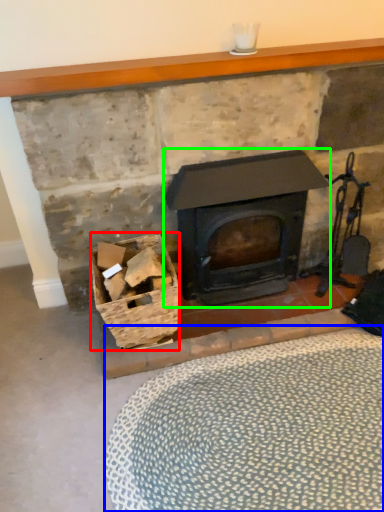
Question: Considering the real-world distances, which object is closest to basket (highlighted by a red box)? plain (highlighted by a blue box) or wood burning stove (highlighted by a green box).

Choices:
 (A) plain
 (B) wood burning stove

Answer: (B)